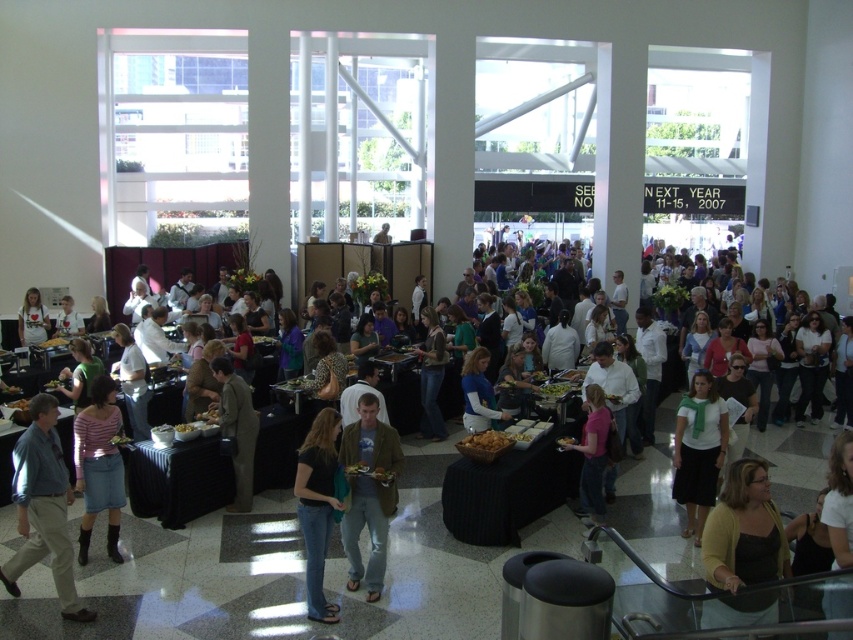
Question: Estimate the real-world distances between objects in this image. Which object is closer to the pink fabric shirt at center?

Choices:
 (A) matte yellow cardigan at lower right
 (B) dark brown leather jacket at center

Answer: (A)

Question: Which point appears closest to the camera in this image?

Choices:
 (A) (479, 410)
 (B) (111, 531)
 (C) (729, 481)

Answer: (C)

Question: Which point appears closest to the camera in this image?

Choices:
 (A) (386, 497)
 (B) (712, 486)

Answer: (A)

Question: Does matte yellow cardigan at lower right appear over white shirt at center?

Choices:
 (A) no
 (B) yes

Answer: (A)

Question: Is denim skirt at lower left thinner than pink fabric shirt at center?

Choices:
 (A) yes
 (B) no

Answer: (B)

Question: Observing the image, what is the correct spatial positioning of white shirt with green scarf at center in reference to matte white shirt at center?

Choices:
 (A) above
 (B) below

Answer: (B)